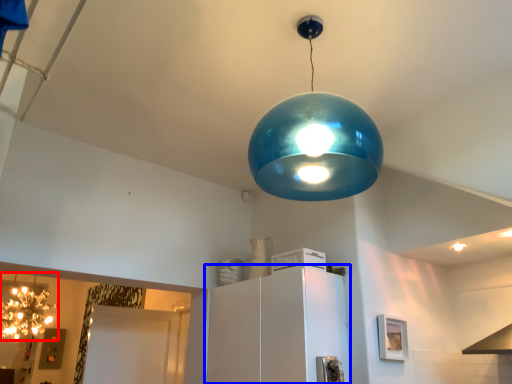
Question: Which object is further to the camera taking this photo, lamp (highlighted by a red box) or cabinetry (highlighted by a blue box)?

Choices:
 (A) lamp
 (B) cabinetry

Answer: (A)